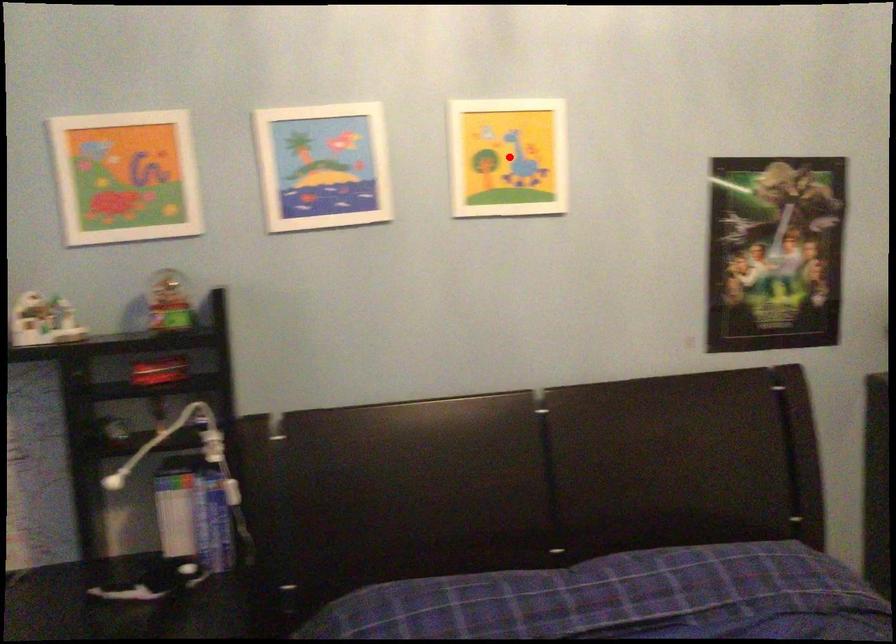
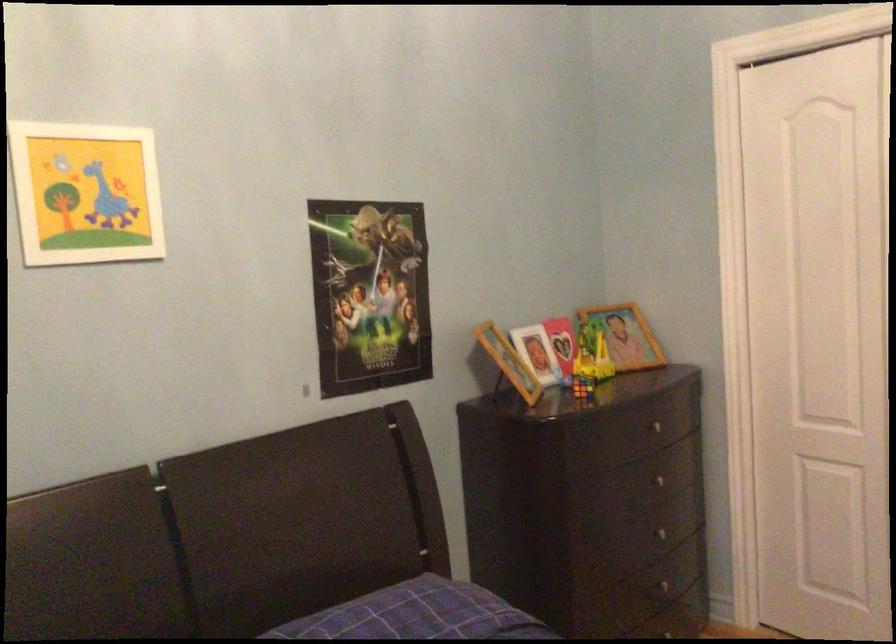
Find the pixel in the second image that matches the highlighted location in the first image.

(85, 193)